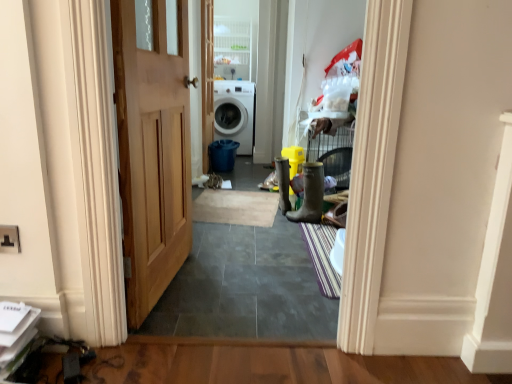
Find the location of a particular element. The width and height of the screenshot is (512, 384). vacant space underneath wooden door at left (from a real-world perspective) is located at coordinates (169, 290).